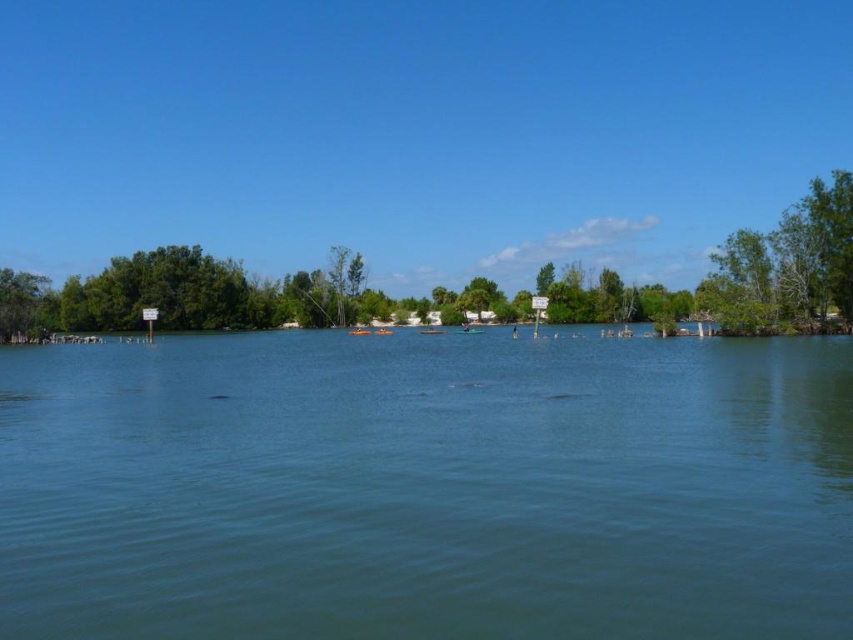
You are standing at point (270, 492) and want to reach a boat that is 50 feet away. Is the boat within your reach?

The distance between you and the boat is 44.48 feet, which is less than 50 feet, so the boat is within your reach.

You are planning to paint a landscape of the scene. You have two canvases, one large and one small. Which object should you paint on the large canvas to match its actual size? The objects are clear blue water at center and green leafy tree at left.

The clear blue water at center is larger in size than the green leafy tree at left, so you should paint the clear blue water at center on the large canvas to match its actual size.